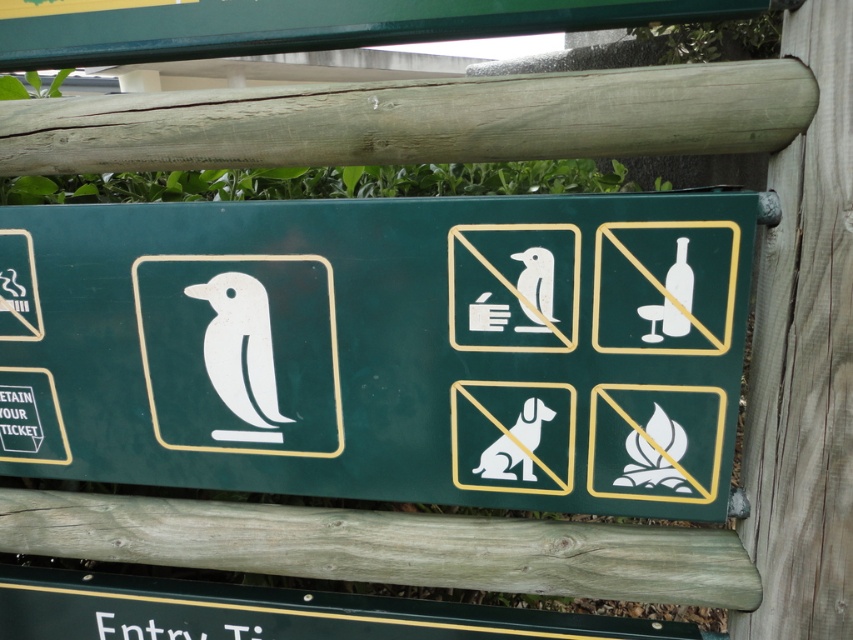
Question: Which point is closer to the camera?

Choices:
 (A) matte green sign at center
 (B) weathered wood pole at upper center
 (C) green matte sign at upper center

Answer: (B)

Question: Can you confirm if matte green sign at center is positioned to the right of green matte sign at upper center?

Choices:
 (A) no
 (B) yes

Answer: (A)

Question: Considering the relative positions of weathered wood pole at upper center and green matte sign at upper center in the image provided, where is weathered wood pole at upper center located with respect to green matte sign at upper center?

Choices:
 (A) below
 (B) above

Answer: (A)

Question: Which object is positioned closest to the matte green sign at center?

Choices:
 (A) weathered wood pole at upper center
 (B) green matte sign at upper center

Answer: (A)

Question: Is weathered wood pole at upper center closer to the viewer compared to green matte sign at upper center?

Choices:
 (A) no
 (B) yes

Answer: (B)

Question: Which object is the closest to the green matte sign at upper center?

Choices:
 (A) matte green sign at center
 (B) weathered wood pole at upper center

Answer: (B)